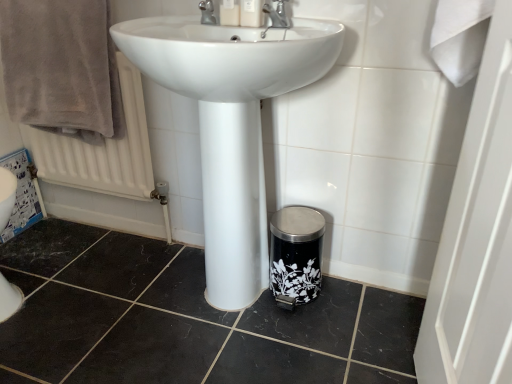
Where is `free area below white glossy sink at center (from a real-world perspective)`? free area below white glossy sink at center (from a real-world perspective) is located at coordinates (216, 299).